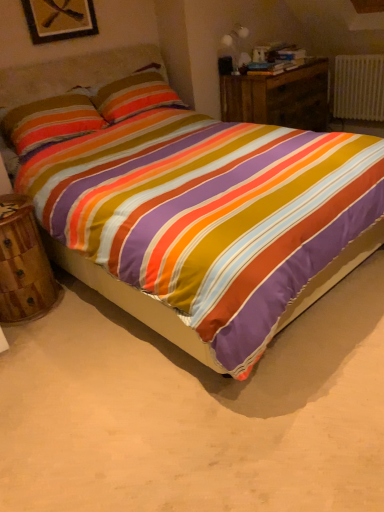
Question: Is wooden nightstand at center, the second nightstand when ordered from left to right, positioned with its back to textured cotton pillow at upper left?

Choices:
 (A) no
 (B) yes

Answer: (A)

Question: Can you confirm if wooden nightstand at center, arranged as the 1th nightstand when viewed from the back, is shorter than textured cotton pillow at upper left?

Choices:
 (A) no
 (B) yes

Answer: (A)

Question: Is wooden nightstand at center, the 1th nightstand in the top-to-bottom sequence, bigger than textured cotton pillow at upper left?

Choices:
 (A) yes
 (B) no

Answer: (A)

Question: Does wooden nightstand at center, the second nightstand when ordered from left to right, have a lesser width compared to textured cotton pillow at upper left?

Choices:
 (A) no
 (B) yes

Answer: (A)

Question: Is wooden nightstand at center, arranged as the 1th nightstand when viewed from the back, to the right of textured cotton pillow at upper left from the viewer's perspective?

Choices:
 (A) no
 (B) yes

Answer: (B)

Question: From a real-world perspective, is matte white table lamp at upper right physically located above or below wooden picture frame at upper left?

Choices:
 (A) below
 (B) above

Answer: (A)

Question: From the image's perspective, is matte white table lamp at upper right above or below wooden picture frame at upper left?

Choices:
 (A) below
 (B) above

Answer: (B)

Question: From their relative heights in the image, would you say matte white table lamp at upper right is taller or shorter than wooden picture frame at upper left?

Choices:
 (A) tall
 (B) short

Answer: (A)

Question: Would you say matte white table lamp at upper right is inside or outside wooden picture frame at upper left?

Choices:
 (A) inside
 (B) outside

Answer: (B)

Question: Considering their positions, is textured cotton pillow at upper left located in front of or behind matte white table lamp at upper right?

Choices:
 (A) behind
 (B) front

Answer: (B)

Question: Is point (16, 133) closer or farther from the camera than point (236, 31)?

Choices:
 (A) farther
 (B) closer

Answer: (B)

Question: From a real-world perspective, is textured cotton pillow at upper left above or below matte white table lamp at upper right?

Choices:
 (A) below
 (B) above

Answer: (A)

Question: Based on their positions, is textured cotton pillow at upper left located to the left or right of matte white table lamp at upper right?

Choices:
 (A) right
 (B) left

Answer: (B)

Question: From the image's perspective, relative to wooden nightstand at center, which is the second nightstand from bottom to top, is textured cotton pillow at upper left above or below?

Choices:
 (A) below
 (B) above

Answer: (A)

Question: Considering the positions of textured cotton pillow at upper left and wooden nightstand at center, the 1th nightstand in the top-to-bottom sequence, in the image, is textured cotton pillow at upper left bigger or smaller than wooden nightstand at center, the 1th nightstand in the top-to-bottom sequence,?

Choices:
 (A) small
 (B) big

Answer: (A)